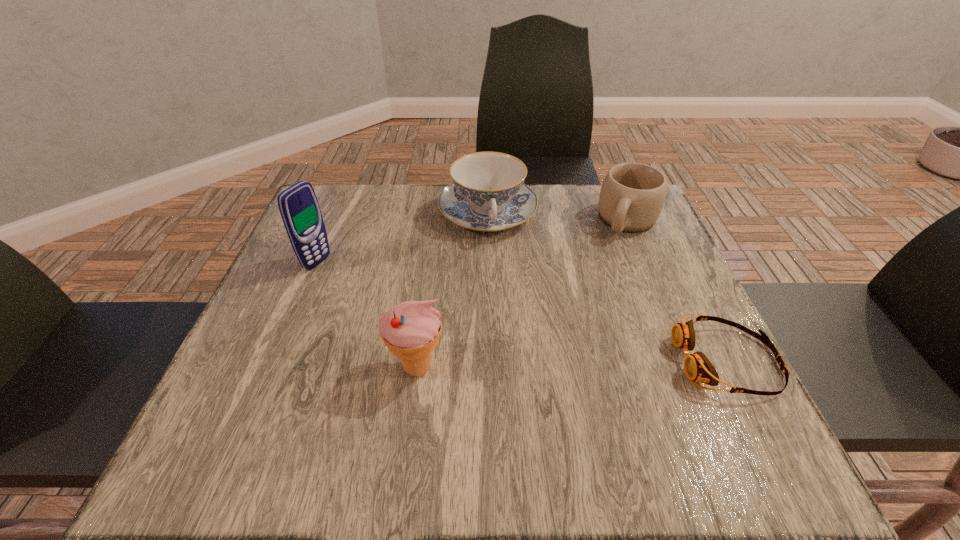
I want to click on vacant space in between the mug and the cellular telephone, so click(x=472, y=241).

Identify the location of vacant space that's between the shortest object and the chinaware. point(608,287).

The width and height of the screenshot is (960, 540). Find the location of `unoccupied position between the mug and the shortest object`. unoccupied position between the mug and the shortest object is located at coordinates (678, 291).

Select which object is the third closest to the chinaware. Please provide its 2D coordinates. Your answer should be formatted as a tuple, i.e. [(x, y)], where the tuple contains the x and y coordinates of a point satisfying the conditions above.

[(411, 330)]

Select which object is the fourth closest to the icecream. Please provide its 2D coordinates. Your answer should be formatted as a tuple, i.e. [(x, y)], where the tuple contains the x and y coordinates of a point satisfying the conditions above.

[(632, 195)]

Where is `free space that satisfies the following two spatial constraints: 1. on the front side of the goggles; 2. with the lenses facing forward on the chinaware`? free space that satisfies the following two spatial constraints: 1. on the front side of the goggles; 2. with the lenses facing forward on the chinaware is located at coordinates (491, 361).

Find the location of a particular element. This screenshot has height=540, width=960. blank area in the image that satisfies the following two spatial constraints: 1. on the front side of the shortest object; 2. with the lenses facing forward on the chinaware is located at coordinates (491, 361).

I want to click on vacant space that satisfies the following two spatial constraints: 1. on the front side of the shortest object; 2. with the lenses facing forward on the third nearest object, so click(x=277, y=361).